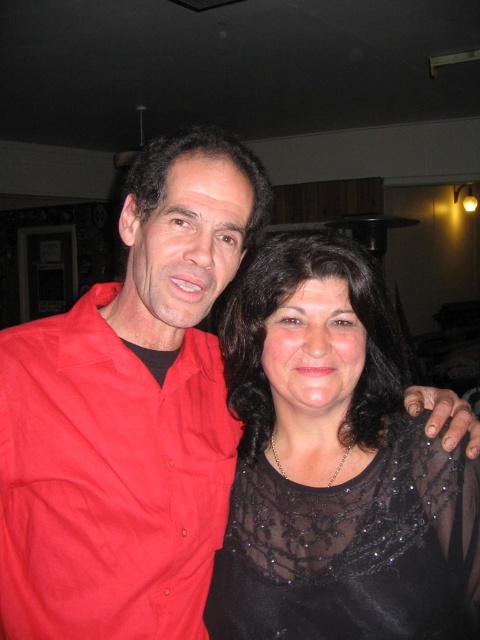
Question: Which object appears closest to the camera in this image?

Choices:
 (A) matte red shirt at left
 (B) black sheer dress at center

Answer: (B)

Question: Among these objects, which one is farthest from the camera?

Choices:
 (A) matte red shirt at left
 (B) black sheer dress at center

Answer: (A)

Question: Is black sheer dress at center further to camera compared to matte red shirt at left?

Choices:
 (A) no
 (B) yes

Answer: (A)

Question: In this image, where is black sheer dress at center located relative to matte red shirt at left?

Choices:
 (A) above
 (B) below

Answer: (A)

Question: Is black sheer dress at center thinner than matte red shirt at left?

Choices:
 (A) yes
 (B) no

Answer: (B)

Question: Which point appears farthest from the camera in this image?

Choices:
 (A) (68, 371)
 (B) (392, 534)

Answer: (A)